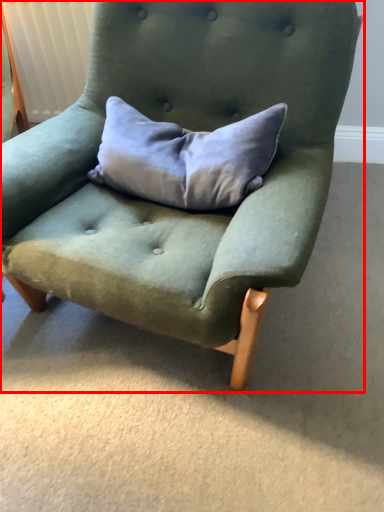
Question: From the image's perspective, considering the relative positions of chair (annotated by the red box) and pillow in the image provided, where is chair (annotated by the red box) located with respect to the staircase?

Choices:
 (A) below
 (B) above

Answer: (A)